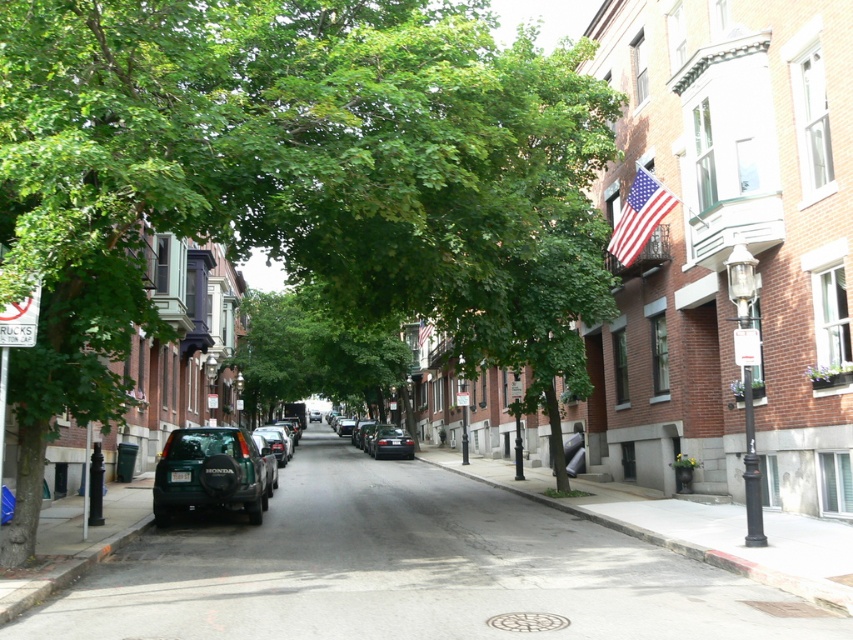
Question: Is green matte suv at center positioned at the back of matte black car at center?

Choices:
 (A) no
 (B) yes

Answer: (A)

Question: Which point is farther from the camera taking this photo?

Choices:
 (A) (386, 428)
 (B) (645, 243)
 (C) (343, 593)
 (D) (207, 492)

Answer: (A)

Question: Which point is farther to the camera?

Choices:
 (A) (379, 452)
 (B) (631, 182)
 (C) (422, 243)

Answer: (A)

Question: Which object appears farthest from the camera in this image?

Choices:
 (A) gray asphalt road at center
 (B) green leafy tree at center

Answer: (B)

Question: Observing the image, what is the correct spatial positioning of green leafy tree at center in reference to american flag at upper right?

Choices:
 (A) above
 (B) below

Answer: (B)

Question: Does shiny black sedan at center come in front of matte black car at center?

Choices:
 (A) yes
 (B) no

Answer: (B)